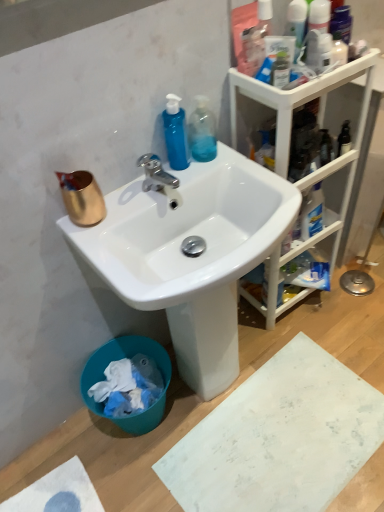
What are the coordinates of `free spot above white plastic cabinet at upper right (from a real-world perspective)` in the screenshot? It's located at (299, 66).